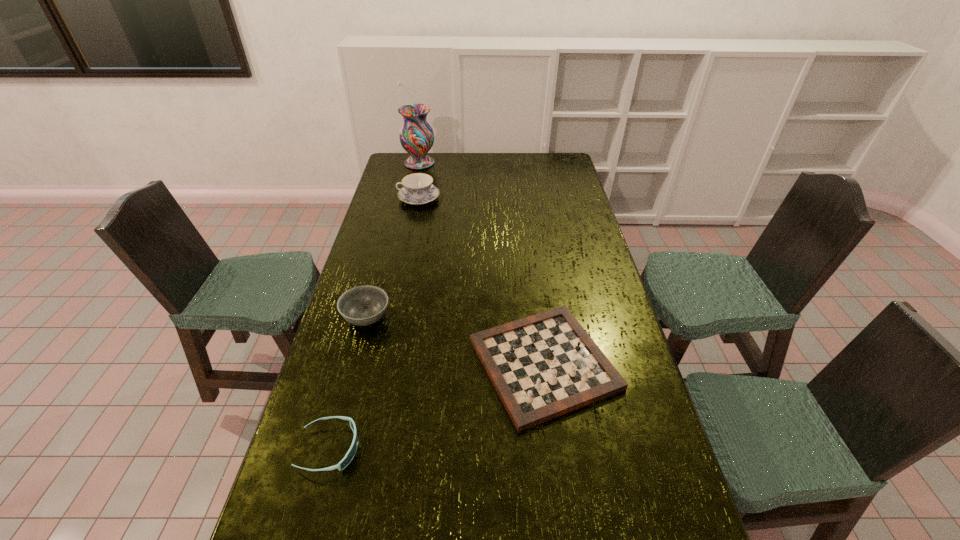
I want to click on object located in the far left corner section of the desktop, so pyautogui.click(x=416, y=135).

In the image, there is a desktop. Where is `free space at the far edge`? free space at the far edge is located at coordinates (499, 158).

This screenshot has width=960, height=540. I want to click on vacant region at the left edge of the desktop, so 348,403.

You are a GUI agent. You are given a task and a screenshot of the screen. Output one action in this format:
    pyautogui.click(x=<x>, y=<y>)
    Task: Click on the vacant space at the right edge
    This screenshot has height=540, width=960.
    Given the screenshot: What is the action you would take?
    pyautogui.click(x=554, y=230)

The width and height of the screenshot is (960, 540). In order to click on free spot between the shortest object and the chessboard in this screenshot , I will do `click(437, 406)`.

Identify the location of free spot between the bowl and the rightmost object. (455, 341).

This screenshot has height=540, width=960. I want to click on vacant area that lies between the goggles and the fourth shortest object, so click(374, 323).

This screenshot has width=960, height=540. I want to click on vacant region between the bowl and the chinaware, so click(x=393, y=258).

The image size is (960, 540). I want to click on free space between the rightmost object and the bowl, so click(x=455, y=341).

Identify the location of free spot between the goggles and the bowl. This screenshot has width=960, height=540. (348, 383).